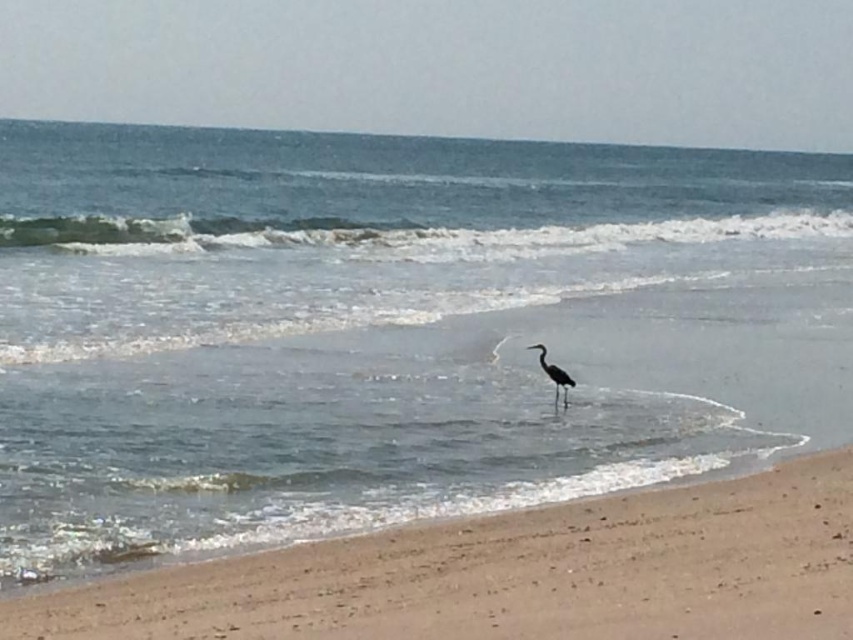
Question: Observing the image, what is the correct spatial positioning of sandy beach at lower right in reference to gray matte heron at center?

Choices:
 (A) above
 (B) below

Answer: (B)

Question: Does sandy beach at lower right come in front of gray matte heron at center?

Choices:
 (A) yes
 (B) no

Answer: (A)

Question: Which object appears farthest from the camera in this image?

Choices:
 (A) gray matte heron at center
 (B) sandy beach at lower right

Answer: (A)

Question: Which point appears farthest from the camera in this image?

Choices:
 (A) (775, 557)
 (B) (561, 387)

Answer: (B)

Question: Which object is farther from the camera taking this photo?

Choices:
 (A) sandy beach at lower right
 (B) gray matte heron at center

Answer: (B)

Question: Does sandy beach at lower right have a greater width compared to gray matte heron at center?

Choices:
 (A) yes
 (B) no

Answer: (A)